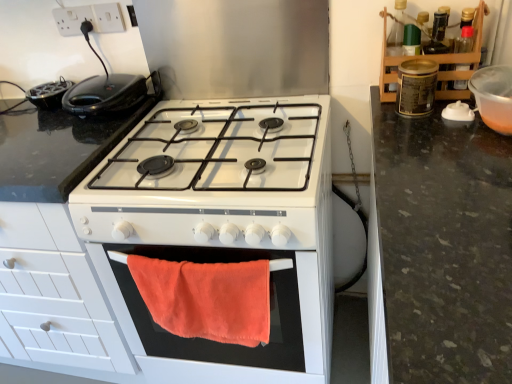
Question: Is the position of white plastic socket at upper left, placed as the second electric outlet when sorted from left to right, more distant than that of metallic canister at upper right, acting as the 3th appliance starting from the left?

Choices:
 (A) no
 (B) yes

Answer: (B)

Question: Does white plastic socket at upper left, which appears as the first electric outlet when viewed from the right, have a greater height compared to metallic canister at upper right, which is the 2th appliance from right to left?

Choices:
 (A) no
 (B) yes

Answer: (A)

Question: From the image's perspective, does white plastic socket at upper left, which appears as the first electric outlet when viewed from the right, appear lower than metallic canister at upper right, which is the 2th appliance from right to left?

Choices:
 (A) no
 (B) yes

Answer: (A)

Question: From a real-world perspective, is white plastic socket at upper left, which appears as the first electric outlet when viewed from the right, on metallic canister at upper right, which is the 2th appliance from right to left?

Choices:
 (A) no
 (B) yes

Answer: (B)

Question: Are white plastic socket at upper left, placed as the second electric outlet when sorted from left to right, and metallic canister at upper right, which is the 2th appliance from right to left, located far from each other?

Choices:
 (A) yes
 (B) no

Answer: (B)

Question: Considering the positions of point (164, 119) and point (56, 96), is point (164, 119) closer or farther from the camera than point (56, 96)?

Choices:
 (A) farther
 (B) closer

Answer: (B)

Question: In the image, is white glossy gas stove at center positioned in front of or behind black plastic toaster at upper left, the 4th appliance when ordered from right to left?

Choices:
 (A) front
 (B) behind

Answer: (A)

Question: In terms of width, does white glossy gas stove at center look wider or thinner when compared to black plastic toaster at upper left, the 4th appliance when ordered from right to left?

Choices:
 (A) thin
 (B) wide

Answer: (B)

Question: Considering the positions of white glossy gas stove at center and black plastic toaster at upper left, the 4th appliance when ordered from right to left, in the image, is white glossy gas stove at center taller or shorter than black plastic toaster at upper left, the 4th appliance when ordered from right to left,?

Choices:
 (A) short
 (B) tall

Answer: (B)

Question: Is white glossy stove at center, the 2th appliance positioned from the left, taller or shorter than black plastic sandwich maker at upper left?

Choices:
 (A) short
 (B) tall

Answer: (B)

Question: From the image's perspective, is white glossy stove at center, the 2th appliance positioned from the left, positioned above or below black plastic sandwich maker at upper left?

Choices:
 (A) above
 (B) below

Answer: (B)

Question: From a real-world perspective, relative to black plastic sandwich maker at upper left, is white glossy stove at center, the 2th appliance positioned from the left, vertically above or below?

Choices:
 (A) above
 (B) below

Answer: (B)

Question: In the image, is white glossy stove at center, the third appliance when ordered from right to left, positioned in front of or behind black plastic sandwich maker at upper left?

Choices:
 (A) front
 (B) behind

Answer: (A)

Question: Relative to metallic canister at upper right, which is the 2th appliance from right to left, is orange fabric towel at center in front or behind?

Choices:
 (A) behind
 (B) front

Answer: (B)

Question: In terms of width, does orange fabric towel at center look wider or thinner when compared to metallic canister at upper right, which is the 2th appliance from right to left?

Choices:
 (A) wide
 (B) thin

Answer: (B)